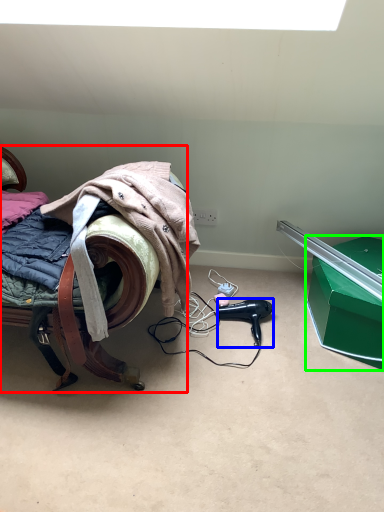
Question: Based on their relative distances, which object is farther from furniture (highlighted by a red box)? Choose from hair dryer (highlighted by a blue box) and box (highlighted by a green box).

Choices:
 (A) hair dryer
 (B) box

Answer: (B)